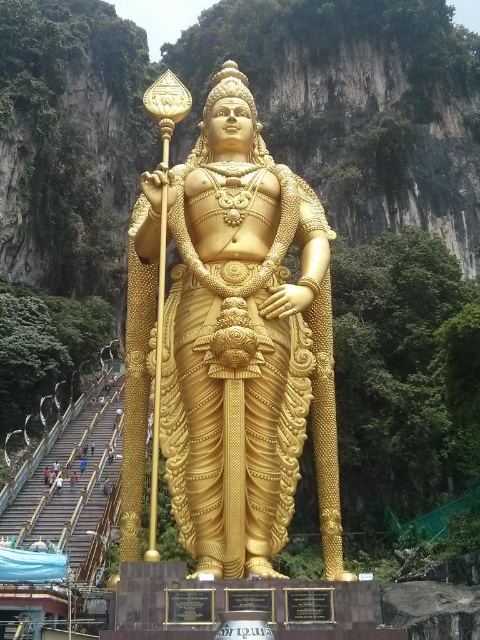
Wait, there seems to be a discrepancy in the object labels. The first object is labeled as gold polished statue at center, while the second is golden statue at center. Given that they both refer to the same statue, why are there two different labels? Could there be an error in the input data?

The two object labels likely refer to the same statue, but there is an inconsistency in the naming. The gold polished statue at center and the golden statue at center are probably the same object, with slight variations in description. The description states that the gold polished statue is larger than the golden statue, which might be an error since they should be the same. Please verify the input data for accuracy.

You are standing at the base of the statue and want to take a photo of the point at coordinates (200, 429). If your camera is 33.69 meters away from that point, is the statue within the camera frame?

The point at coordinates (200, 429) is exactly 33.69 meters away from the camera, so the statue is within the camera frame since the point is at that distance.